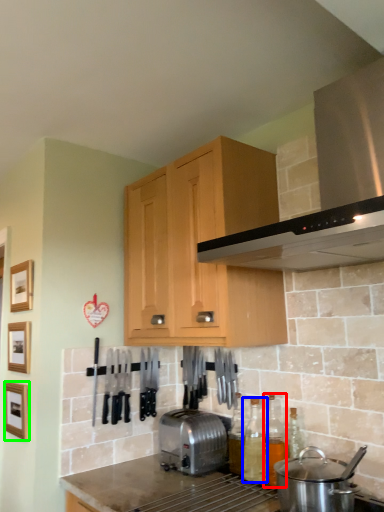
Question: Which object is positioned farthest from bottle (highlighted by a red box)? Select from bottle (highlighted by a blue box) and picture frame (highlighted by a green box).

Choices:
 (A) bottle
 (B) picture frame

Answer: (B)